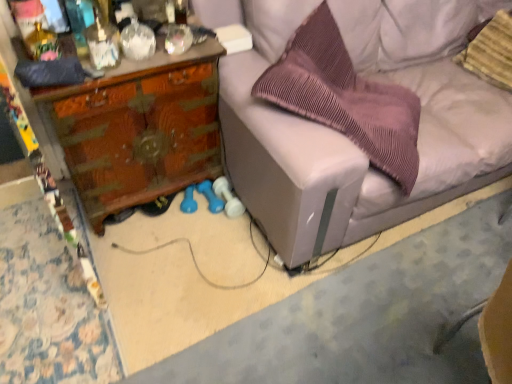
Question: Would you consider light gray fabric couch at center to be distant from wooden desk at left?

Choices:
 (A) yes
 (B) no

Answer: (B)

Question: Considering the relative positions of light gray fabric couch at center and wooden desk at left in the image provided, is light gray fabric couch at center behind wooden desk at left?

Choices:
 (A) no
 (B) yes

Answer: (A)

Question: Does light gray fabric couch at center turn towards wooden desk at left?

Choices:
 (A) no
 (B) yes

Answer: (A)

Question: Is light gray fabric couch at center wider than wooden desk at left?

Choices:
 (A) no
 (B) yes

Answer: (B)

Question: From a real-world perspective, is light gray fabric couch at center located beneath wooden desk at left?

Choices:
 (A) yes
 (B) no

Answer: (B)

Question: From the image's perspective, is light gray fabric couch at center under wooden desk at left?

Choices:
 (A) no
 (B) yes

Answer: (A)

Question: From a real-world perspective, is wooden desk at left positioned under light gray fabric couch at center based on gravity?

Choices:
 (A) no
 (B) yes

Answer: (B)

Question: Can you confirm if wooden desk at left is smaller than light gray fabric couch at center?

Choices:
 (A) no
 (B) yes

Answer: (B)

Question: From the image's perspective, is wooden desk at left below light gray fabric couch at center?

Choices:
 (A) yes
 (B) no

Answer: (A)

Question: Is wooden desk at left outside light gray fabric couch at center?

Choices:
 (A) no
 (B) yes

Answer: (B)

Question: Is wooden desk at left facing away from light gray fabric couch at center?

Choices:
 (A) no
 (B) yes

Answer: (A)

Question: From the image's perspective, is wooden desk at left above light gray fabric couch at center?

Choices:
 (A) no
 (B) yes

Answer: (A)

Question: Can you confirm if purple pleated pillow at center, which is the 2th pillow in right-to-left order, is bigger than striped fabric pillow at upper right, acting as the second pillow starting from the left?

Choices:
 (A) no
 (B) yes

Answer: (B)